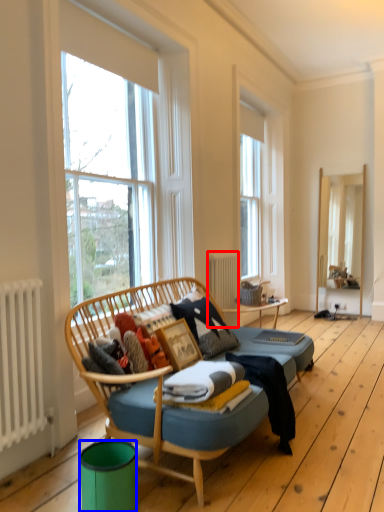
Question: Among these objects, which one is nearest to the camera, radiator (highlighted by a red box) or trash bin/can (highlighted by a blue box)?

Choices:
 (A) radiator
 (B) trash bin/can

Answer: (B)